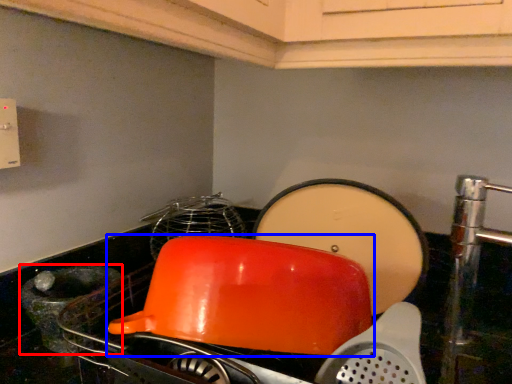
Question: Among these objects, which one is nearest to the camera, appliance (highlighted by a red box) or kitchen appliance (highlighted by a blue box)?

Choices:
 (A) appliance
 (B) kitchen appliance

Answer: (B)